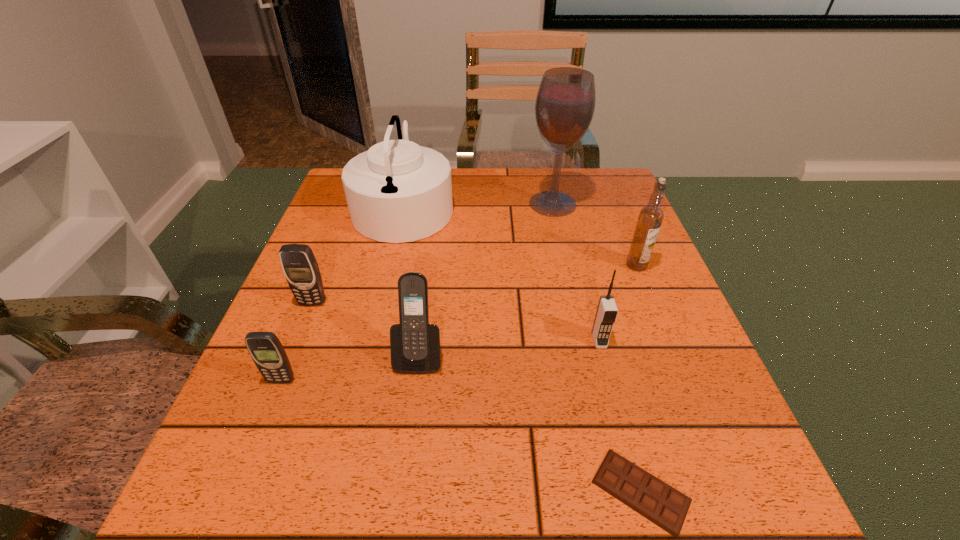
What are the coordinates of `kettle at the far edge` in the screenshot? It's located at (397, 191).

Where is `object present at the near edge`? The width and height of the screenshot is (960, 540). object present at the near edge is located at coordinates (657, 501).

You are a GUI agent. You are given a task and a screenshot of the screen. Output one action in this format:
    pyautogui.click(x=<x>, y=<y>)
    Task: Click on the kettle that is at the left edge
    
    Given the screenshot: What is the action you would take?
    pyautogui.click(x=397, y=191)

Find the location of `alcohol that is at the right edge`. alcohol that is at the right edge is located at coordinates (565, 103).

Where is `vodka that is at the right edge`? The height and width of the screenshot is (540, 960). vodka that is at the right edge is located at coordinates (650, 218).

The height and width of the screenshot is (540, 960). In order to click on chocolate bar situated at the right edge in this screenshot , I will do `click(657, 501)`.

The width and height of the screenshot is (960, 540). Find the location of `object that is at the far left corner`. object that is at the far left corner is located at coordinates (397, 191).

This screenshot has height=540, width=960. In order to click on object located at the far right corner in this screenshot , I will do `click(565, 103)`.

In order to click on object present at the near right corner in this screenshot , I will do `click(657, 501)`.

In the image, there is a desktop. Identify the location of vacant area at the far edge. (537, 173).